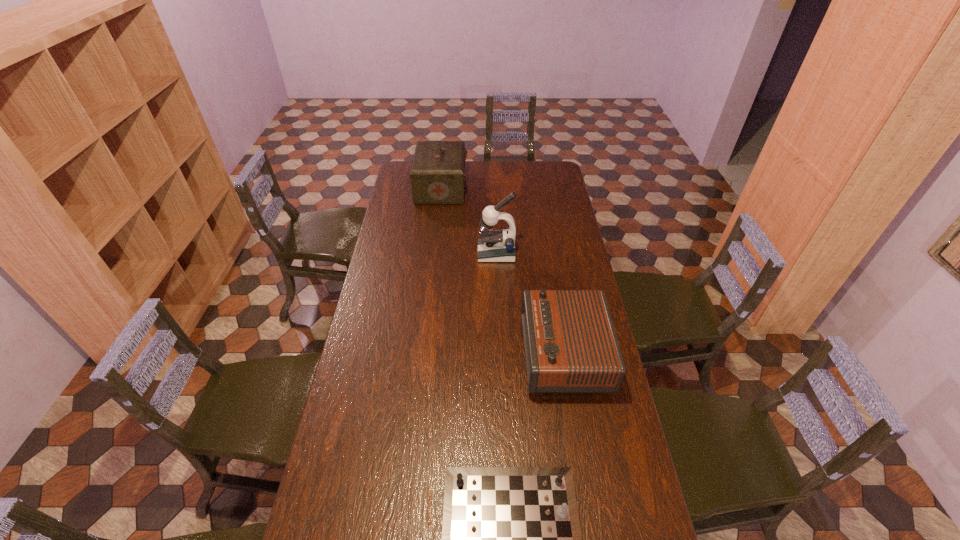
Identify the location of the tallest object. (495, 245).

The width and height of the screenshot is (960, 540). In order to click on the third nearest object in this screenshot , I will do `click(495, 245)`.

Locate an element on the screen. This screenshot has height=540, width=960. the first-aid kit is located at coordinates (437, 175).

Find the location of a particular element. This screenshot has width=960, height=540. the third farthest object is located at coordinates (570, 344).

Find the location of `radio receiver`. radio receiver is located at coordinates (570, 344).

At what (x,y) coordinates should I click in order to perform the action: click on vacant region located 0.330m on the back of the tallest object. Please return your answer as a coordinate pair (x, y). Looking at the image, I should click on (494, 203).

At what (x,y) coordinates should I click in order to perform the action: click on vacant region located 0.350m on the front of the first-aid kit. Please return your answer as a coordinate pair (x, y). Image resolution: width=960 pixels, height=540 pixels. Looking at the image, I should click on (434, 249).

Where is `free space located 0.060m on the front panel of the radio receiver`? The width and height of the screenshot is (960, 540). free space located 0.060m on the front panel of the radio receiver is located at coordinates (507, 353).

Where is `vacant space located 0.130m on the front panel of the radio receiver`? vacant space located 0.130m on the front panel of the radio receiver is located at coordinates [x=488, y=353].

You are a GUI agent. You are given a task and a screenshot of the screen. Output one action in this format:
    pyautogui.click(x=<x>, y=<y>)
    Task: Click on the free space located 0.050m on the front panel of the radio receiver
    This screenshot has width=960, height=540.
    Given the screenshot: What is the action you would take?
    pyautogui.click(x=510, y=353)